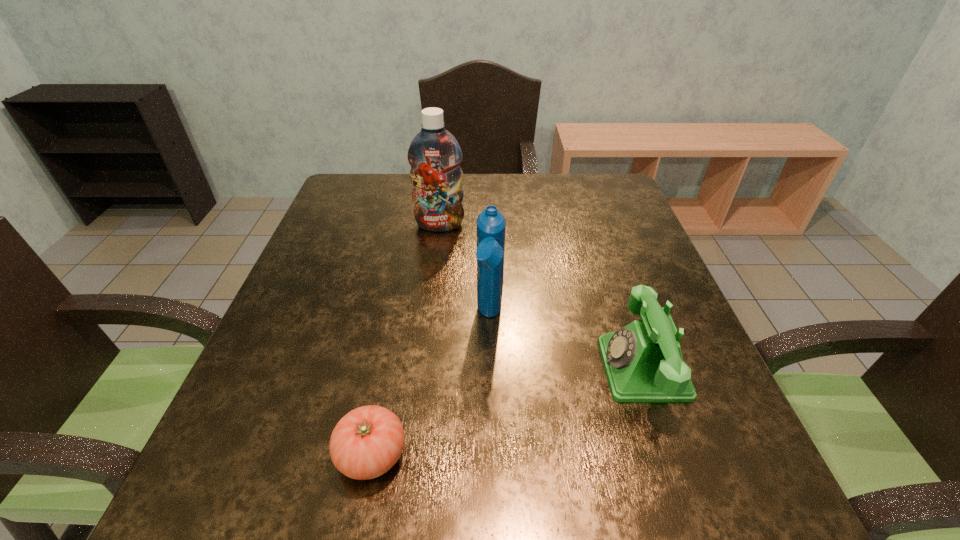
Locate an element on the screen. The height and width of the screenshot is (540, 960). vacant space in between the third object from left to right and the third tallest object is located at coordinates (566, 342).

Choose which object is the third nearest neighbor to the taller shampoo. Please provide its 2D coordinates. Your answer should be formatted as a tuple, i.e. [(x, y)], where the tuple contains the x and y coordinates of a point satisfying the conditions above.

[(367, 442)]

Identify the location of object that ranks as the second closest to the tomato. (643, 362).

The image size is (960, 540). I want to click on vacant position in the image that satisfies the following two spatial constraints: 1. on the dial of the telephone; 2. on the front side of the shortest object, so click(672, 455).